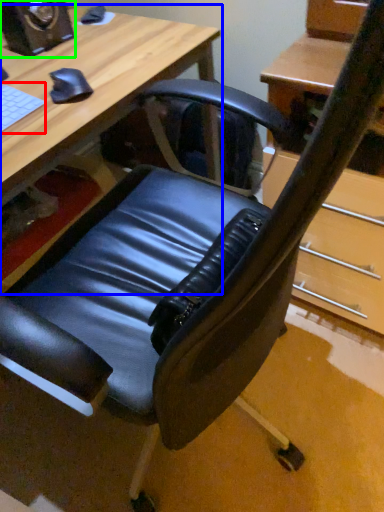
Question: Which object is positioned closest to laptop keyboard (highlighted by a red box)? Select from desk (highlighted by a blue box) and speaker (highlighted by a green box).

Choices:
 (A) desk
 (B) speaker

Answer: (A)